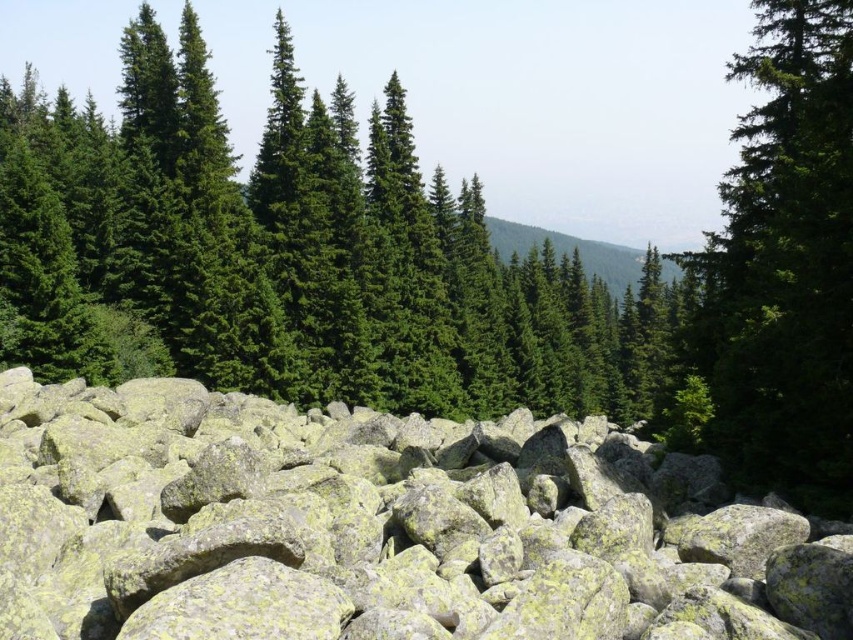
Question: Is yellow-green rock at center behind green matte tree at upper right?

Choices:
 (A) no
 (B) yes

Answer: (A)

Question: Can you confirm if yellow-green rock at center is thinner than green matte tree at upper right?

Choices:
 (A) yes
 (B) no

Answer: (A)

Question: Which point is farther to the camera?

Choices:
 (A) yellow-green rock at center
 (B) green matte tree at upper right

Answer: (B)

Question: Can you confirm if yellow-green rock at center is positioned to the left of green matte tree at upper right?

Choices:
 (A) no
 (B) yes

Answer: (B)

Question: Which point is closer to the camera?

Choices:
 (A) (757, 301)
 (B) (306, 486)

Answer: (B)